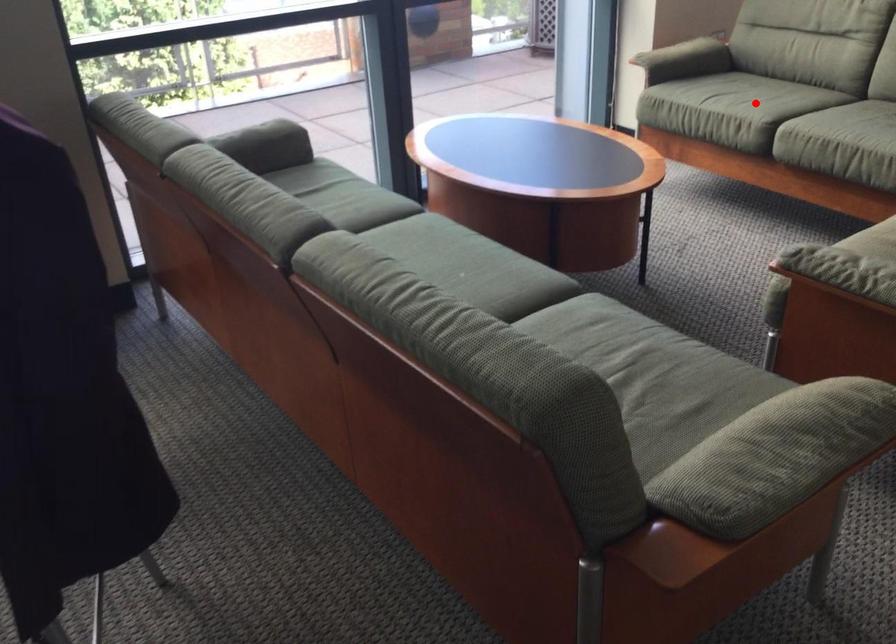
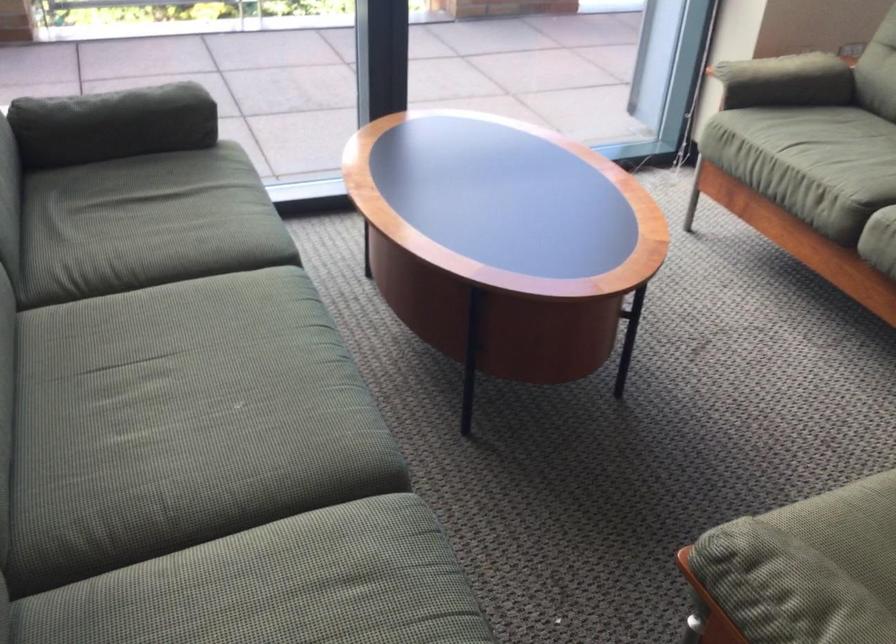
Where in the second image is the point corresponding to the highlighted location from the first image?

(846, 180)